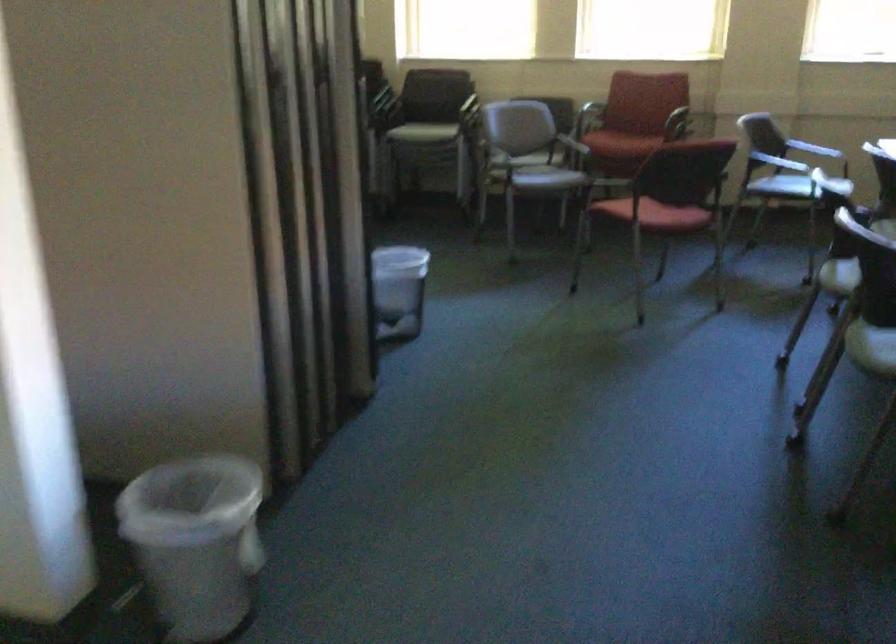
Describe the element at coordinates (573, 145) in the screenshot. I see `the grey chair armrest` at that location.